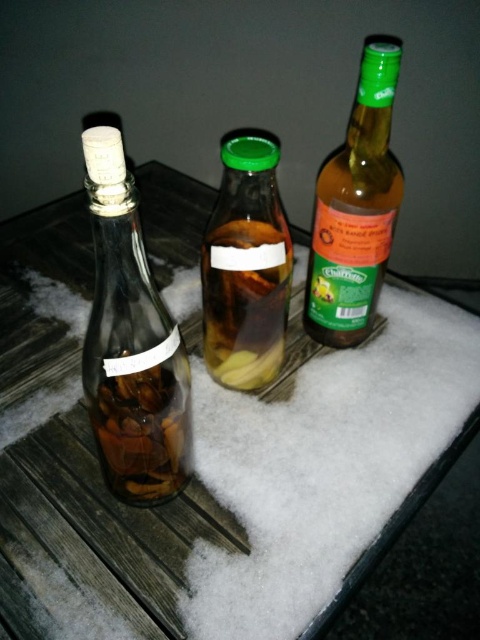
You have two bottles on a snowy wooden surface. The clear glass bottle at left and the green glass bottle at right. Which one can hold more liquid?

The clear glass bottle at left is bigger than the green glass bottle at right, so it can hold more liquid.

You are organizing a winter party and need to choose a bottle for serving drinks. The clear glass bottle at left and the green glass bottle at right are available. Which bottle should you choose if you want the taller one?

The clear glass bottle at left is taller than the green glass bottle at right, so you should choose the clear glass bottle at left for serving drinks if you want the taller one.

You are looking at the scene from the front. Please state the 2D coordinates of the green glass bottle at right in the image. The coordinates are normalized between 0 and 1, with the origin at the bottom left corner of the image.

The 2D coordinates of the green glass bottle at right are at point (356, 211).